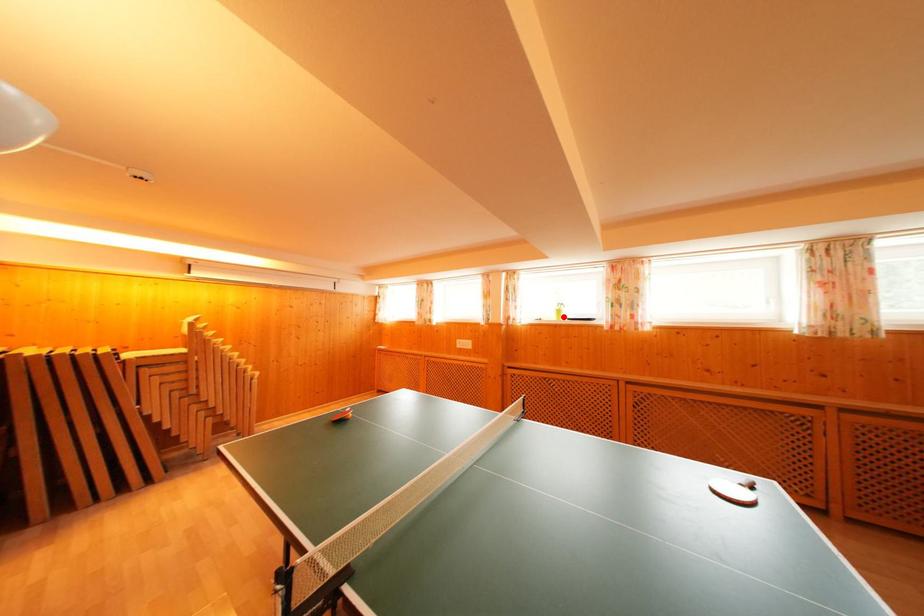
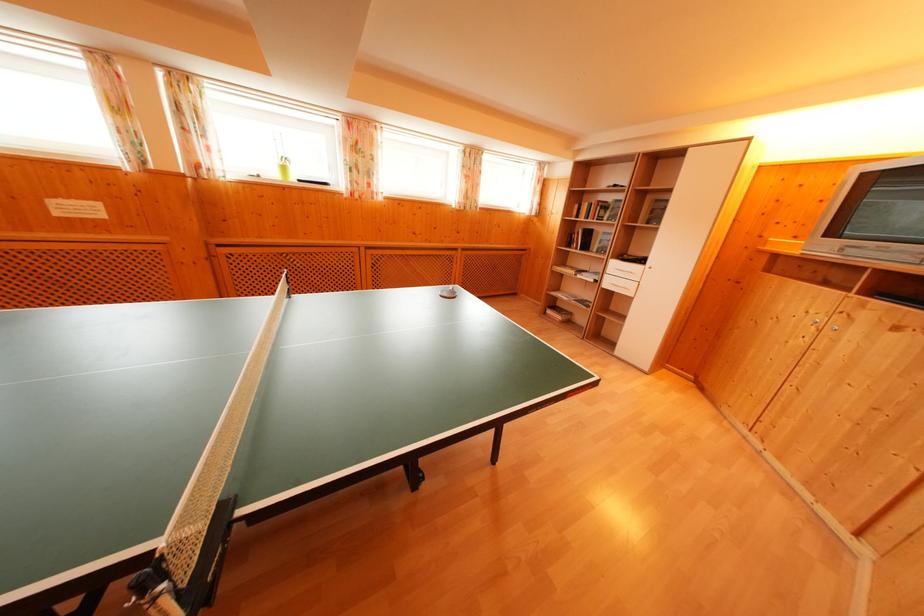
Find the pixel in the second image that matches the highlighted location in the first image.

(288, 174)